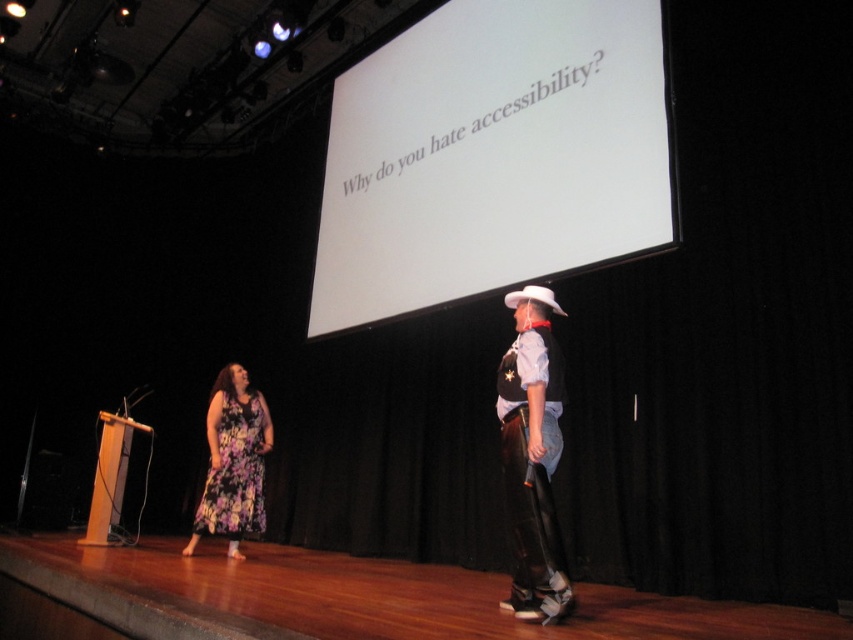
Question: Based on their relative distances, which object is nearer to the white matte projection screen at upper center?

Choices:
 (A) leather cowboy boots at right
 (B) floral fabric dress at lower left

Answer: (A)

Question: Which point is closer to the camera taking this photo?

Choices:
 (A) (242, 528)
 (B) (354, 74)

Answer: (A)

Question: Can you confirm if white matte projection screen at upper center is wider than leather cowboy boots at right?

Choices:
 (A) yes
 (B) no

Answer: (A)

Question: Is white matte projection screen at upper center to the right of leather cowboy boots at right from the viewer's perspective?

Choices:
 (A) no
 (B) yes

Answer: (A)

Question: Which point is closer to the camera?

Choices:
 (A) leather cowboy boots at right
 (B) white matte projection screen at upper center

Answer: (A)

Question: Does white matte projection screen at upper center have a greater width compared to floral fabric dress at lower left?

Choices:
 (A) yes
 (B) no

Answer: (A)